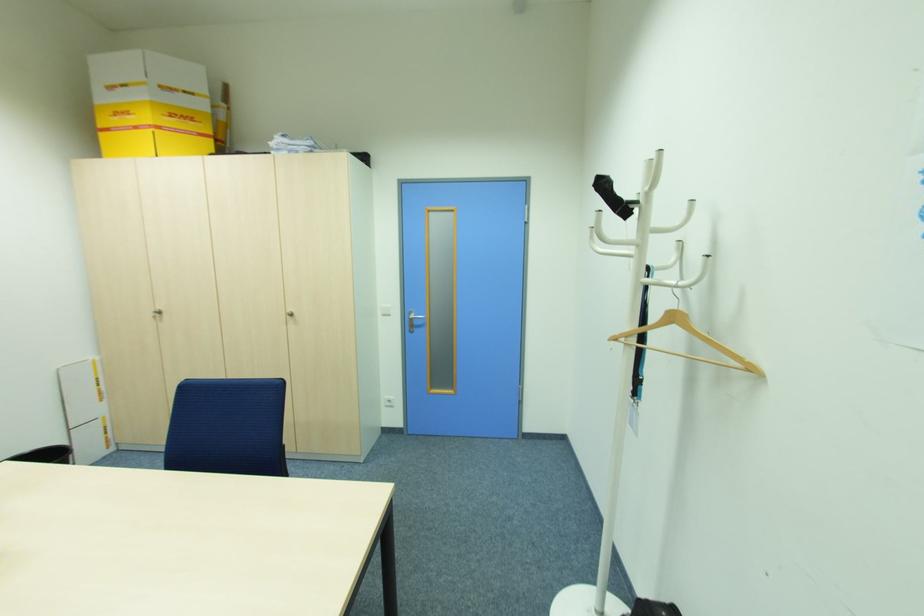
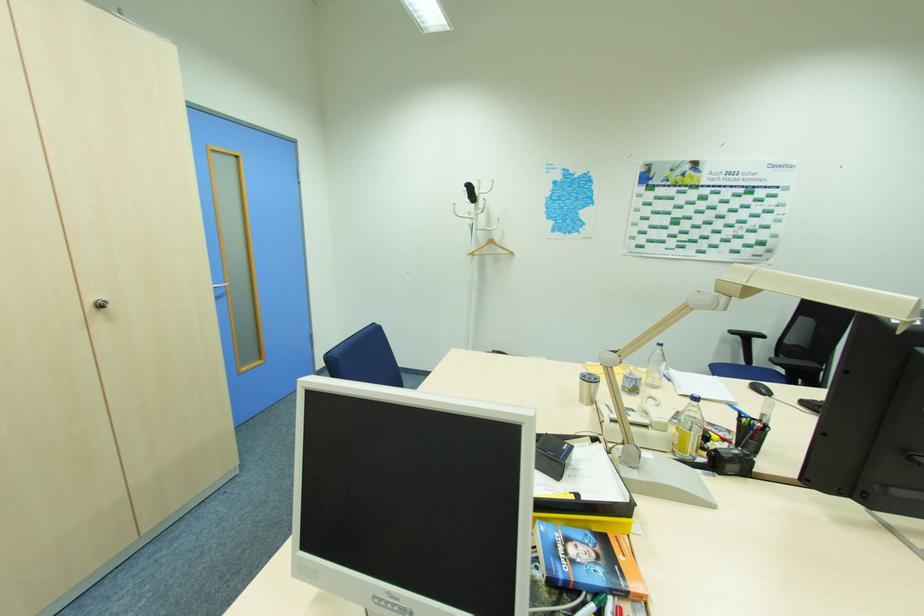
Where in the second image is the point corresponding to point 639,201 from the first image?

(479, 197)